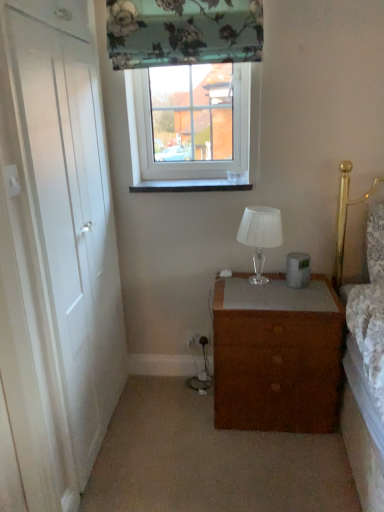
Where is `space that is in front of white glass lamp at center`? This screenshot has width=384, height=512. space that is in front of white glass lamp at center is located at coordinates (257, 293).